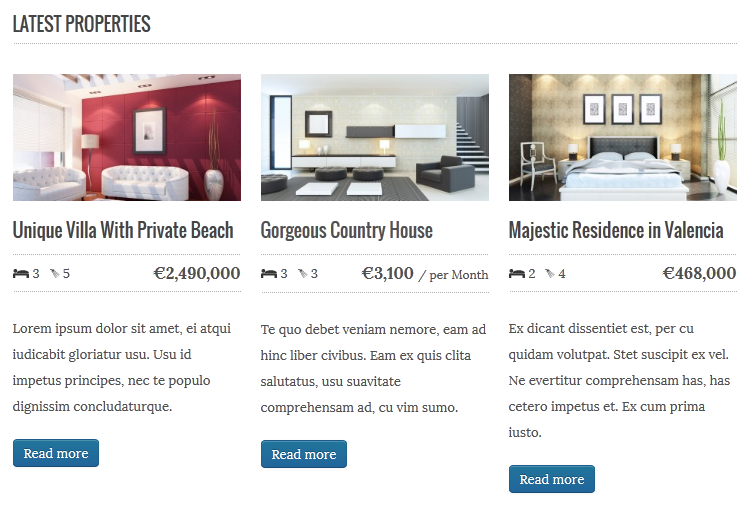
What are the coordinates of `sofa` in the screenshot? It's located at (139, 176), (38, 182).